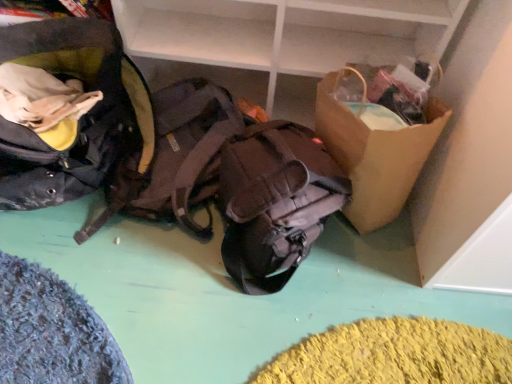
Locate an element on the screen. Image resolution: width=512 pixels, height=384 pixels. vacant area that is in front of brown fabric backpack at center, which is the 2th backpack in left-to-right order is located at coordinates (143, 287).